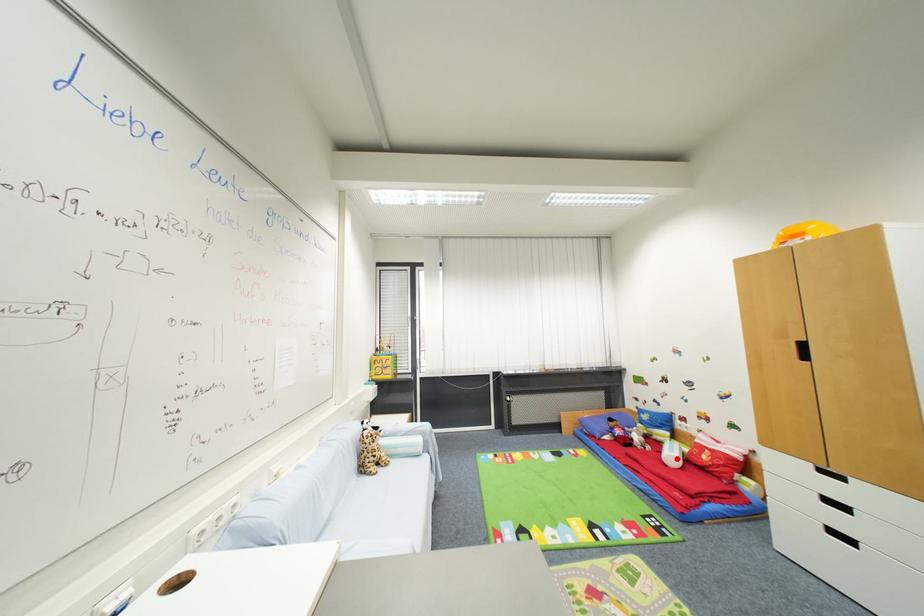
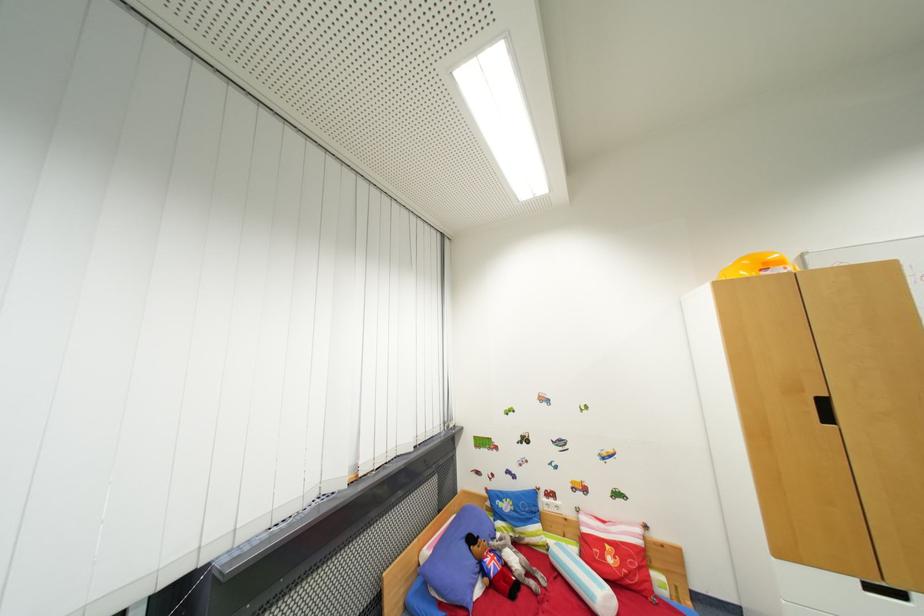
The point at the highlighted location is marked in the first image. Where is the corresponding point in the second image?

(605, 596)